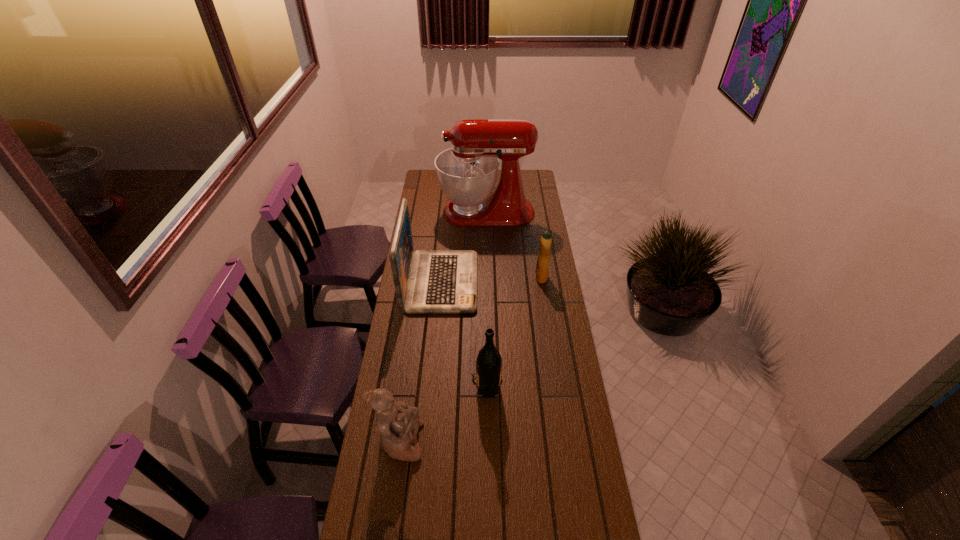
This screenshot has height=540, width=960. In order to click on free spot located 0.150m on the label of the detergent in this screenshot , I will do `click(503, 277)`.

You are a GUI agent. You are given a task and a screenshot of the screen. Output one action in this format:
    pyautogui.click(x=<x>, y=<y>)
    Task: Click on the free space located 0.200m on the label of the detergent
    This screenshot has width=960, height=540.
    Given the screenshot: What is the action you would take?
    pyautogui.click(x=492, y=277)

This screenshot has height=540, width=960. Identify the location of free spot located on the label of the detergent. (518, 277).

Where is `mixer that is at the left edge`? The height and width of the screenshot is (540, 960). mixer that is at the left edge is located at coordinates (467, 172).

This screenshot has height=540, width=960. Find the location of `laptop computer situated at the left edge`. laptop computer situated at the left edge is located at coordinates (426, 281).

You are a GUI agent. You are given a task and a screenshot of the screen. Output one action in this format:
    pyautogui.click(x=<x>, y=<y>)
    Task: Click on the figurine present at the left edge
    Image resolution: width=960 pixels, height=540 pixels.
    Given the screenshot: What is the action you would take?
    pyautogui.click(x=398, y=423)

In order to click on mixer present at the right edge in this screenshot , I will do `click(467, 172)`.

Where is `detergent located in the right edge section of the desktop`? The image size is (960, 540). detergent located in the right edge section of the desktop is located at coordinates (542, 264).

In the image, there is a desktop. What are the coordinates of `vacant space at the left edge` in the screenshot? It's located at (407, 386).

In the image, there is a desktop. Identify the location of vacant space at the right edge. (530, 264).